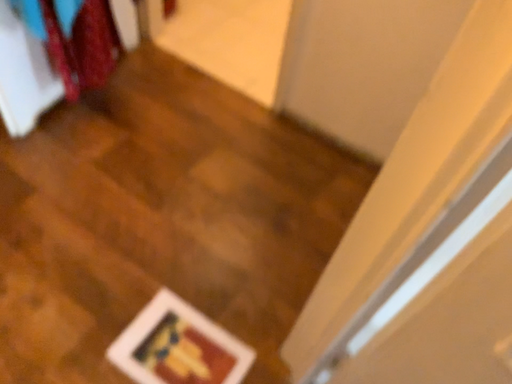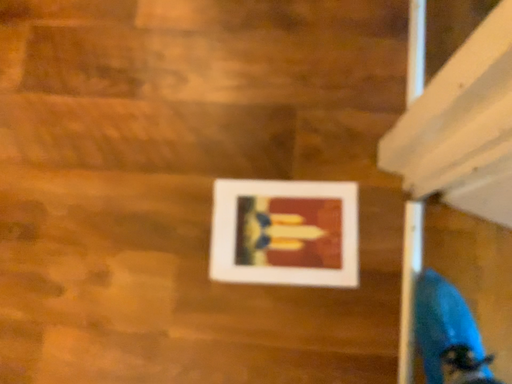
Question: How did the camera likely rotate when shooting the video?

Choices:
 (A) rotated upward
 (B) rotated downward

Answer: (B)